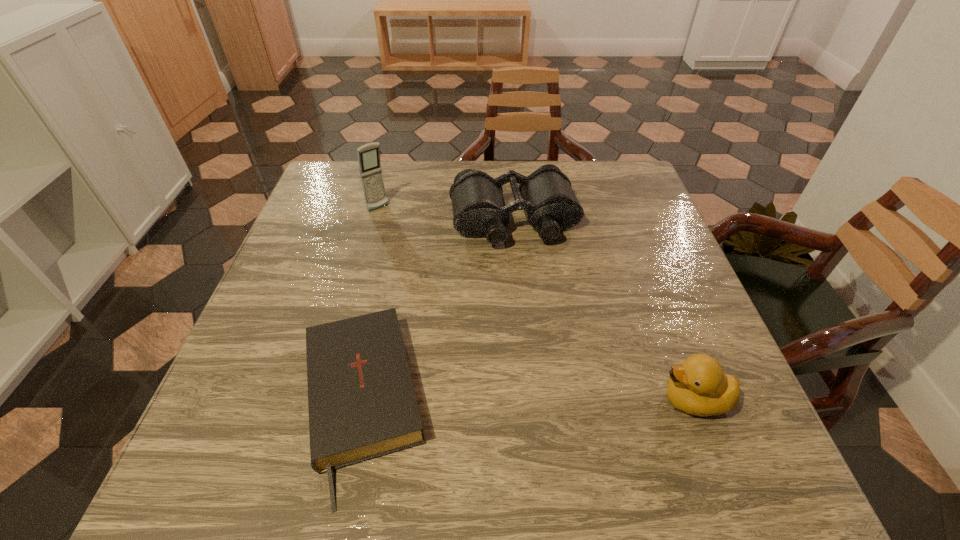
Locate an element on the screen. Image resolution: width=960 pixels, height=540 pixels. free space on the desktop that is between the Bible and the rightmost object and is positioned on the front-facing side of the tallest object is located at coordinates (545, 402).

Where is `vacant space on the desktop that is between the Bible and the duckling and is positioned through the eyepieces of the third object from left to right`? This screenshot has height=540, width=960. vacant space on the desktop that is between the Bible and the duckling and is positioned through the eyepieces of the third object from left to right is located at coordinates pos(564,402).